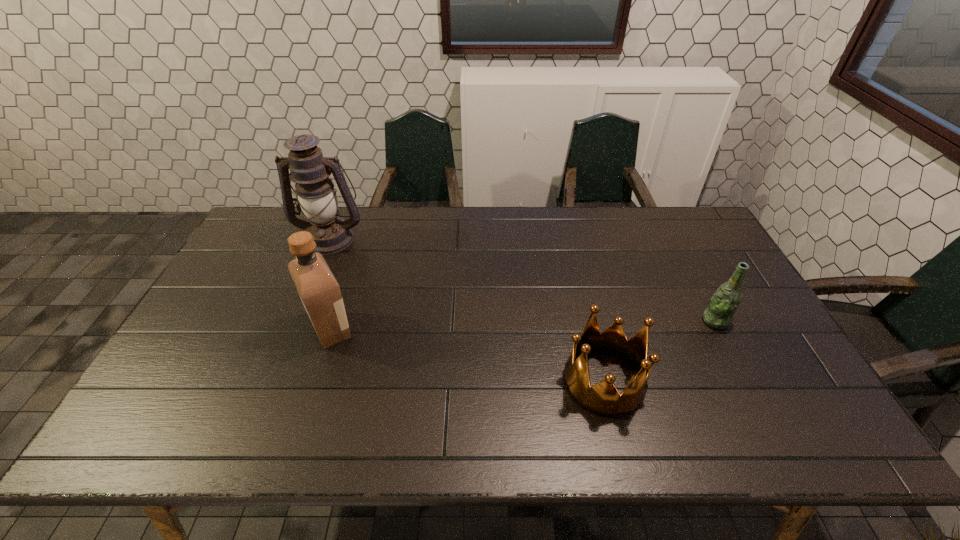
In order to click on object present at the far edge in this screenshot , I will do `click(316, 196)`.

Where is `object at the near edge`? object at the near edge is located at coordinates (602, 399).

This screenshot has height=540, width=960. Identify the location of object present at the right edge. (725, 301).

Identify the location of free space at the far edge of the desktop. The width and height of the screenshot is (960, 540). (475, 233).

In the image, there is a desktop. Identify the location of vacant space at the near edge. (591, 442).

Find the location of a particular element. blank space at the left edge of the desktop is located at coordinates (266, 275).

What are the coordinates of `free space at the right edge` in the screenshot? It's located at (731, 348).

I want to click on vacant space at the far right corner of the desktop, so click(x=708, y=247).

You are a GUI agent. You are given a task and a screenshot of the screen. Output one action in this format:
    pyautogui.click(x=<x>, y=<y>)
    Task: Click on the vacant space that is in between the farthest object and the second object from right to left
    This screenshot has width=960, height=540.
    Given the screenshot: What is the action you would take?
    coord(468,310)

At what (x,y) coordinates should I click in order to perform the action: click on free space that is in between the beer bottle and the liquor. Please return your answer as a coordinate pair (x, y). Image resolution: width=960 pixels, height=540 pixels. Looking at the image, I should click on (523, 325).